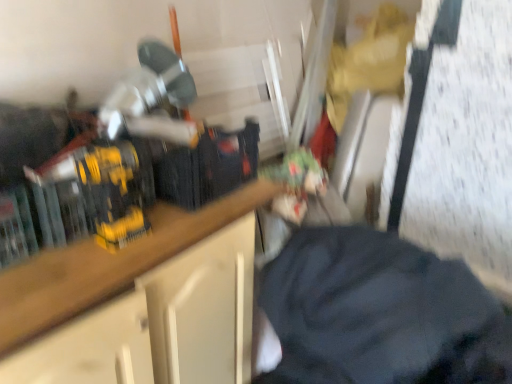
What do you see at coordinates (106, 265) in the screenshot? I see `wooden countertop at center` at bounding box center [106, 265].

The image size is (512, 384). I want to click on wooden countertop at center, so click(106, 265).

Find the location of a particular element. This screenshot has height=384, width=512. black fabric at center is located at coordinates (380, 313).

What do you see at coordinates (380, 313) in the screenshot? I see `black fabric at center` at bounding box center [380, 313].

You are a GUI agent. You are given a task and a screenshot of the screen. Output one action in this format:
    pyautogui.click(x=<x>, y=<y>)
    Task: Click on the wooden countertop at center
    
    Given the screenshot: What is the action you would take?
    pyautogui.click(x=106, y=265)

Considering the relative positions of black fabric at center and wooden countertop at center in the image provided, is black fabric at center to the left or to the right of wooden countertop at center?

From the image, it's evident that black fabric at center is to the right of wooden countertop at center.

Does black fabric at center come behind wooden countertop at center?

No, it is not.

Is point (446, 343) closer or farther from the camera than point (262, 200)?

Point (446, 343) is closer to the camera than point (262, 200).

From the image's perspective, between black fabric at center and wooden countertop at center, which one is located above?

black fabric at center is shown above in the image.

From a real-world perspective, relative to wooden countertop at center, is black fabric at center vertically above or below?

Clearly, from a real-world perspective, black fabric at center is above wooden countertop at center.

Is black fabric at center wider than wooden countertop at center?

Yes.

Who is shorter, black fabric at center or wooden countertop at center?

black fabric at center is shorter.

Looking at the image, does black fabric at center seem bigger or smaller compared to wooden countertop at center?

Considering their sizes, black fabric at center takes up less space than wooden countertop at center.

Based on the photo, is black fabric at center inside the boundaries of wooden countertop at center, or outside?

The correct answer is: outside.

Consider the image. Is black fabric at center in contact with wooden countertop at center?

No, black fabric at center is not with wooden countertop at center.

Is black fabric at center oriented towards wooden countertop at center?

No, black fabric at center is not facing towards wooden countertop at center.

How different are the orientations of black fabric at center and wooden countertop at center in degrees?

86.9 degrees separate the facing orientations of black fabric at center and wooden countertop at center.

Find the location of `cabinetry to the left of black fabric at center`. cabinetry to the left of black fabric at center is located at coordinates (106, 265).

Which is more to the left, wooden countertop at center or black fabric at center?

Positioned to the left is wooden countertop at center.

Looking at this image, does wooden countertop at center come in front of black fabric at center?

No, wooden countertop at center is further to the viewer.

Considering the positions of points (73, 298) and (486, 348), is point (73, 298) farther from camera compared to point (486, 348)?

No, it is not.

From the image's perspective, is wooden countertop at center beneath black fabric at center?

Indeed, from the image's perspective, wooden countertop at center is shown beneath black fabric at center.

From a real-world perspective, who is located higher, wooden countertop at center or black fabric at center?

In real-world perspective, black fabric at center is above.

Which object is wider, wooden countertop at center or black fabric at center?

black fabric at center.

Which of these two, wooden countertop at center or black fabric at center, stands taller?

With more height is wooden countertop at center.

Can you confirm if wooden countertop at center is bigger than black fabric at center?

Correct, wooden countertop at center is larger in size than black fabric at center.

Is black fabric at center located within wooden countertop at center?

Actually, black fabric at center is outside wooden countertop at center.

Are wooden countertop at center and black fabric at center far apart?

wooden countertop at center is near black fabric at center, not far away.

Is wooden countertop at center oriented away from black fabric at center?

wooden countertop at center is not turned away from black fabric at center.

From the picture: How different are the orientations of wooden countertop at center and black fabric at center in degrees?

There is a 86.9-degree angle between the facing directions of wooden countertop at center and black fabric at center.

Identify the location of cabinetry located on the left of black fabric at center. (106, 265).

This screenshot has width=512, height=384. I want to click on clothing on the right of wooden countertop at center, so click(380, 313).

Find the location of a particular element. cabinetry behind the black fabric at center is located at coordinates (106, 265).